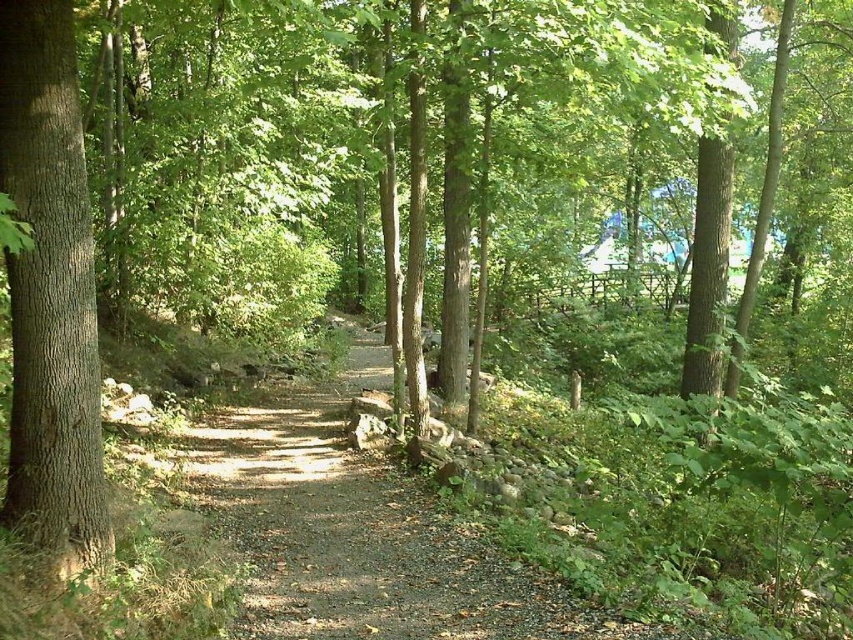
Does dirt path at center have a greater width compared to smooth brown tree trunk at left?

Correct, the width of dirt path at center exceeds that of smooth brown tree trunk at left.

Is dirt path at center bigger than smooth brown tree trunk at left?

Yes.

Which is in front, point (289, 544) or point (68, 225)?

Positioned in front is point (68, 225).

The height and width of the screenshot is (640, 853). What are the coordinates of `dirt path at center` in the screenshot? It's located at (358, 532).